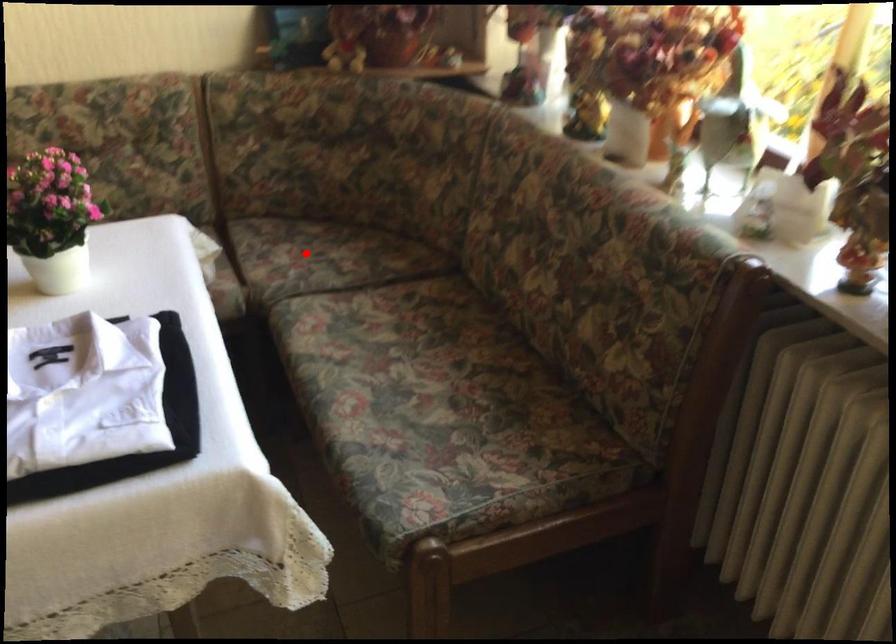
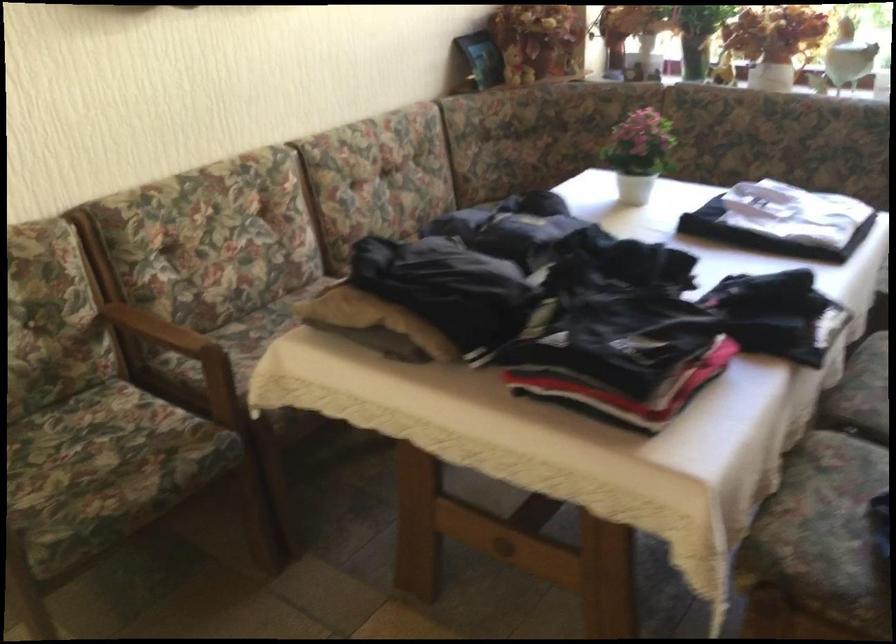
Question: I am providing you with two images of the same scene from different viewpoints. A red point is marked on the first image. At the location where the point appears in image 1, is it still visible in image 2?

Choices:
 (A) Yes
 (B) No

Answer: (B)